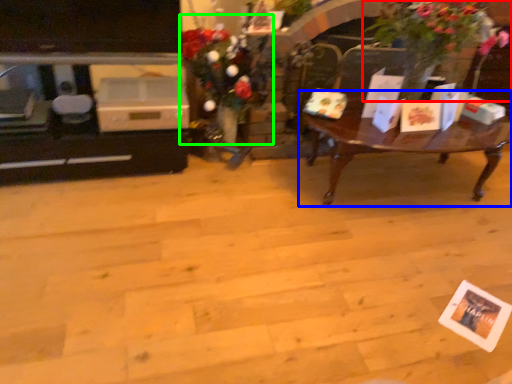
Question: Considering the real-world distances, which object is farthest from houseplant (highlighted by a red box)? coffee table (highlighted by a blue box) or floral arrangement (highlighted by a green box)?

Choices:
 (A) coffee table
 (B) floral arrangement

Answer: (B)